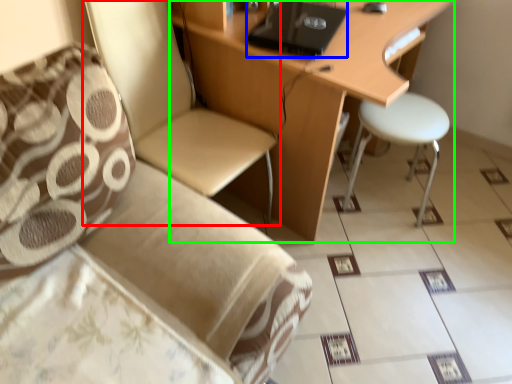
Question: Which object is positioned farthest from chair (highlighted by a red box)? Select from laptop (highlighted by a blue box) and desk (highlighted by a green box).

Choices:
 (A) laptop
 (B) desk

Answer: (A)